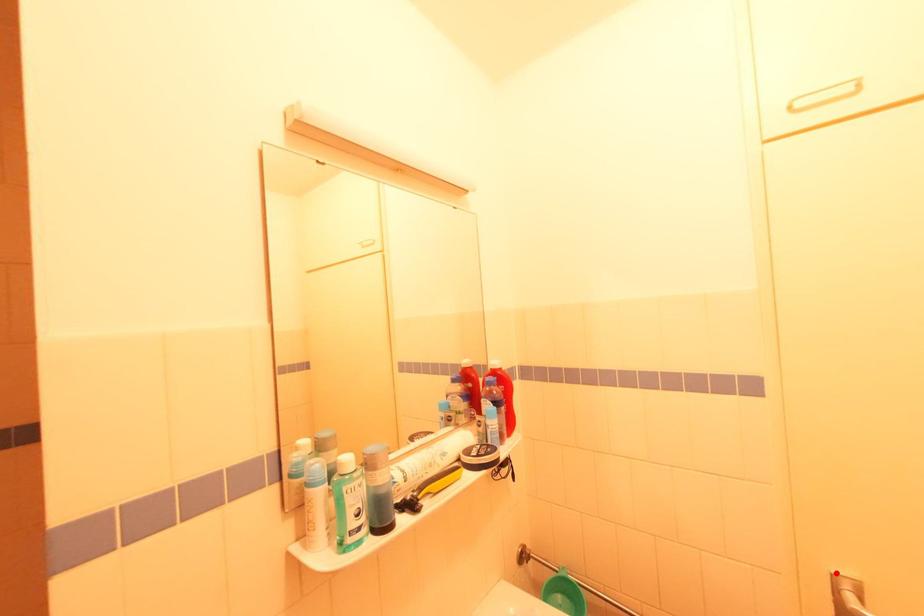
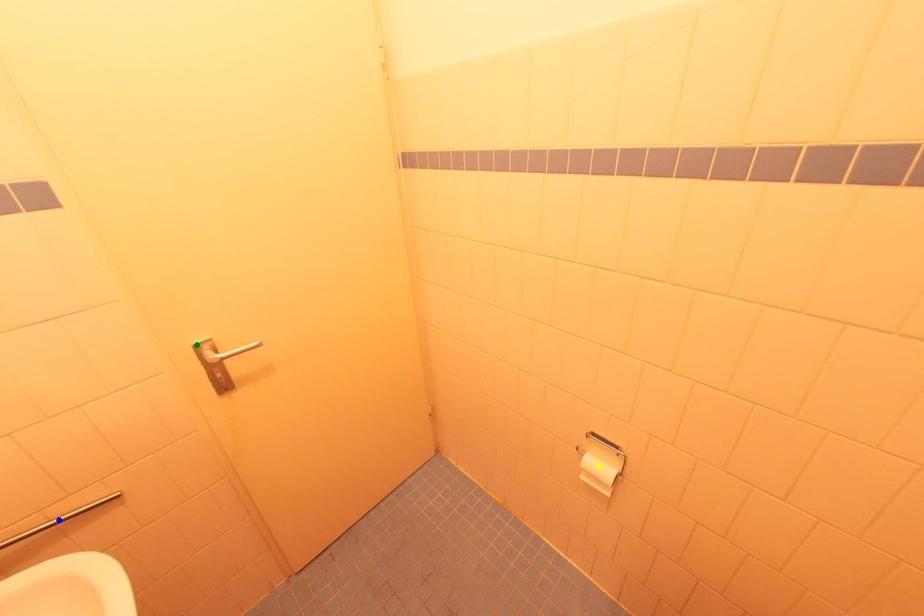
Question: I am providing you with two images of the same scene from different viewpoints. A red point is marked on the first image. You are given multiple points on the second image. Which point in image 2 is actually the same real-world point as the red point in image 1?

Choices:
 (A) blue point
 (B) yellow point
 (C) green point

Answer: (C)